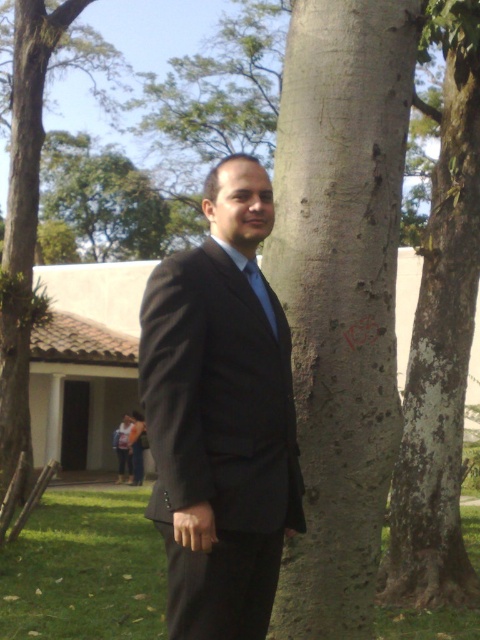
You are a park ranger trying to identify trees in the area. There is a point marked at coordinates (340, 292). Which tree trunk does this point correspond to?

The point at coordinates (340, 292) marks the smooth bark tree trunk at center.

You are a fashion designer observing a man in a park setting. You notice the matte black suit at center and the blue satin tie at center. Which clothing item is positioned lower on his body?

The matte black suit at center is positioned lower on his body than the blue satin tie at center.